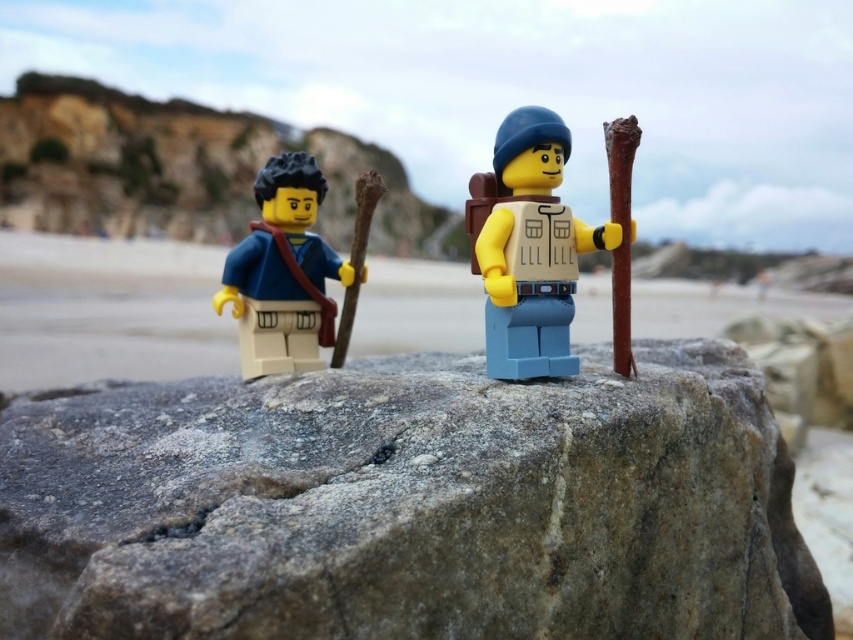
Which is below, gray rough rock at center or matte blue fabric backpack at left?

gray rough rock at center is below.

Measure the distance between gray rough rock at center and matte blue fabric backpack at left.

A distance of 10.34 inches exists between gray rough rock at center and matte blue fabric backpack at left.

Which is behind, point (733, 515) or point (306, 305)?

The point (306, 305) is behind.

Image resolution: width=853 pixels, height=640 pixels. I want to click on gray rough rock at center, so click(x=409, y=506).

Is matte brown backpack at center above matte blue fabric backpack at left?

Yes.

I want to click on matte brown backpack at center, so click(x=508, y=248).

Which is below, smooth sand at lower left or matte brown backpack at center?

smooth sand at lower left is lower down.

Is smooth sand at lower left taller than matte brown backpack at center?

In fact, smooth sand at lower left may be shorter than matte brown backpack at center.

Measure the distance between smooth sand at lower left and camera.

The distance of smooth sand at lower left from camera is 5.71 feet.

In order to click on smooth sand at lower left in this screenshot , I will do `click(108, 310)`.